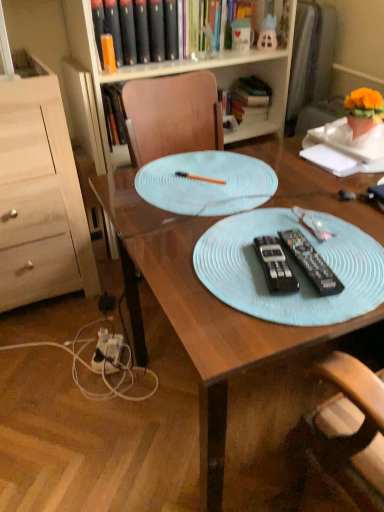
Question: From a real-world perspective, is black plastic remote control at center, marked as the second remote control in a right-to-left arrangement, above or below black plastic remote control at center, the 1th remote control when ordered from right to left?

Choices:
 (A) below
 (B) above

Answer: (A)

Question: In the image, is black plastic remote control at center, which appears as the 1th remote control when viewed from the left, on the left side or the right side of black plastic remote control at center, the 1th remote control when ordered from right to left?

Choices:
 (A) left
 (B) right

Answer: (A)

Question: Which object is positioned closest to the orange plastic pen at center?

Choices:
 (A) hardcover book at upper center, which is the 2th book in right-to-left order
 (B) light wood dresser at left
 (C) light blue textured placemat at upper center
 (D) white plastic power outlet at lower left
 (E) hardcover book at upper center, which appears as the first book when viewed from the right

Answer: (C)

Question: Estimate the real-world distances between objects in this image. Which object is closer to the white paper at upper right?

Choices:
 (A) black plastic remote control at center, which appears as the 1th remote control when viewed from the left
 (B) hardcover book at upper center, the second book positioned from the left
 (C) black plastic remote control at center, the 1th remote control when ordered from right to left
 (D) white plastic power outlet at lower left
 (E) orange plastic pen at center

Answer: (E)